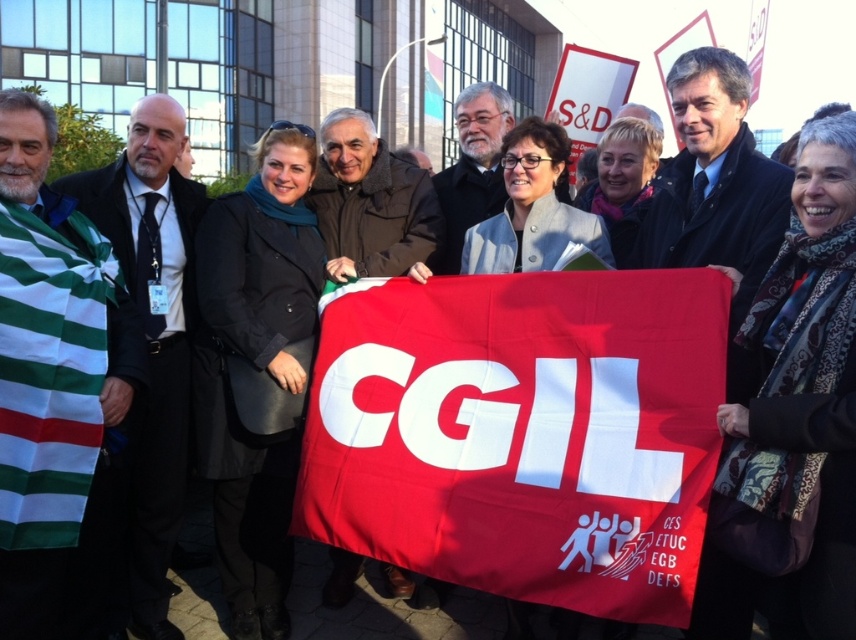
Can you confirm if dark gray suit at left is smaller than dark brown leather jacket at center?

No.

Does dark gray suit at left have a greater width compared to dark brown leather jacket at center?

Correct, the width of dark gray suit at left exceeds that of dark brown leather jacket at center.

Who is more distant from viewer, (171, 528) or (390, 595)?

The point (390, 595) is more distant.

This screenshot has width=856, height=640. I want to click on dark gray suit at left, so click(150, 344).

Between red fabric flag at center and dark brown leather jacket at center, which one has less height?

Standing shorter between the two is dark brown leather jacket at center.

Is red fabric flag at center shorter than dark brown leather jacket at center?

In fact, red fabric flag at center may be taller than dark brown leather jacket at center.

Is point (652, 404) farther from camera compared to point (351, 589)?

That is False.

I want to click on red fabric flag at center, so click(522, 433).

Is green and white striped scarf at left shorter than dark blue wool coat at center?

Yes, green and white striped scarf at left is shorter than dark blue wool coat at center.

Does point (51, 316) come closer to viewer compared to point (721, 180)?

Yes.

Who is more forward, (x=37, y=461) or (x=740, y=68)?

Point (x=37, y=461) is in front.

At what (x,y) coordinates should I click in order to perform the action: click on green and white striped scarf at left. Please return your answer as a coordinate pair (x, y). Looking at the image, I should click on (49, 372).